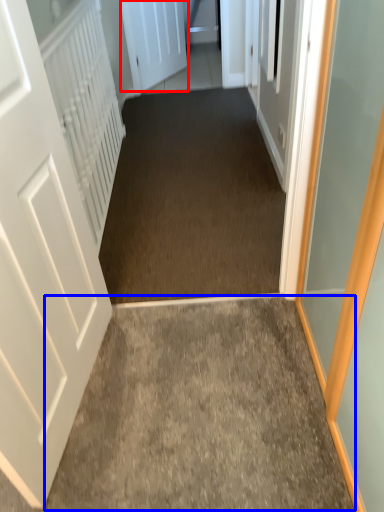
Question: Which of the following is the closest to the observer, door (highlighted by a red box) or path (highlighted by a blue box)?

Choices:
 (A) door
 (B) path

Answer: (B)